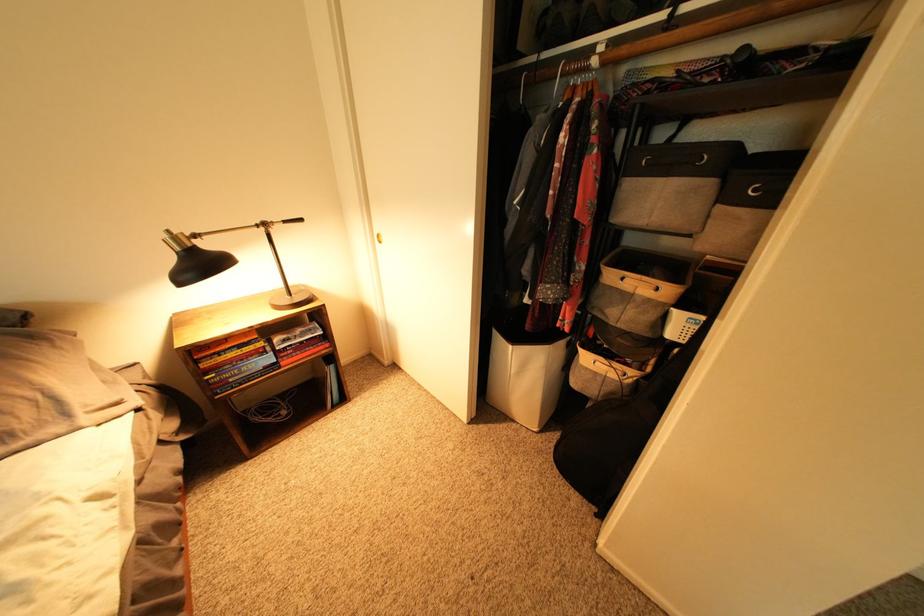
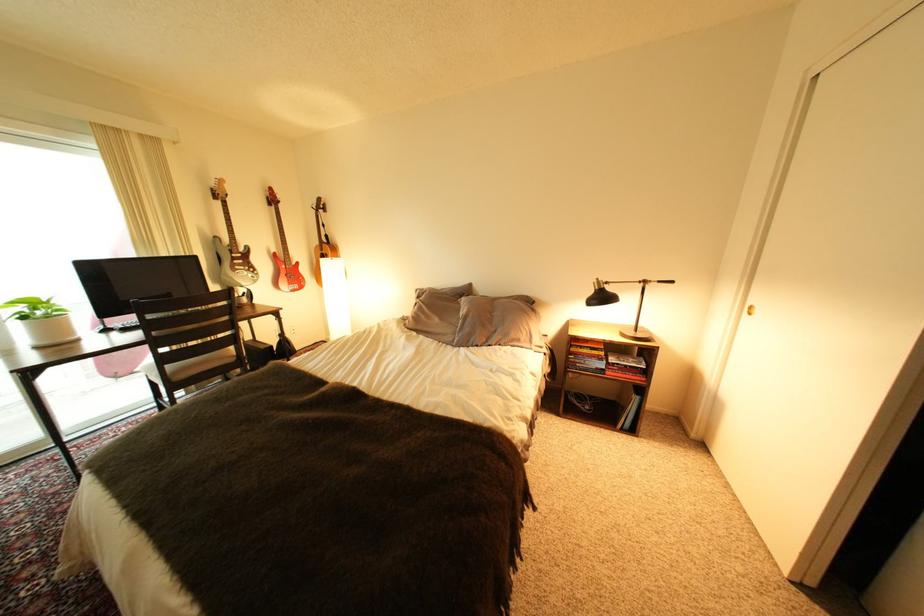
Where in the second image is the point corresponding to (x=325, y=379) from the first image?

(628, 403)